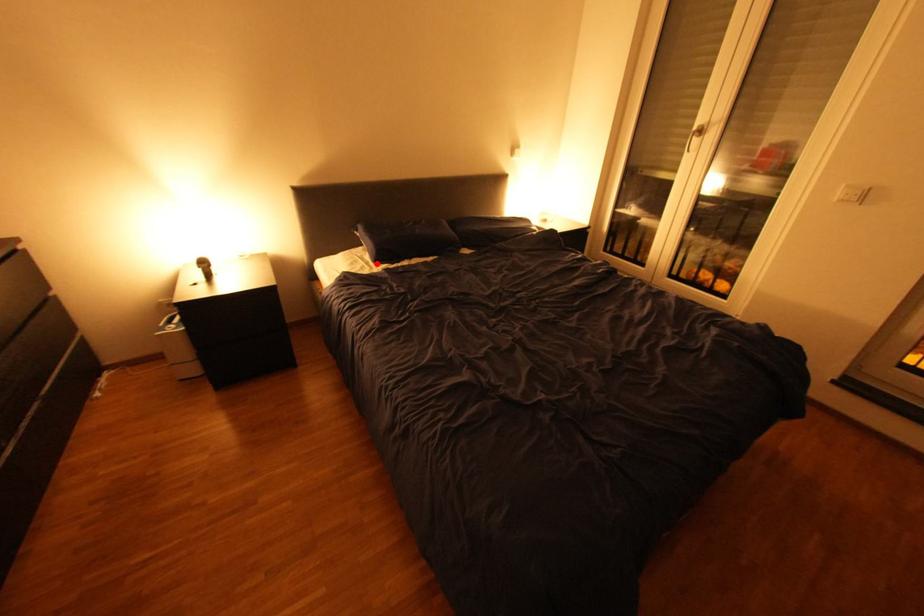
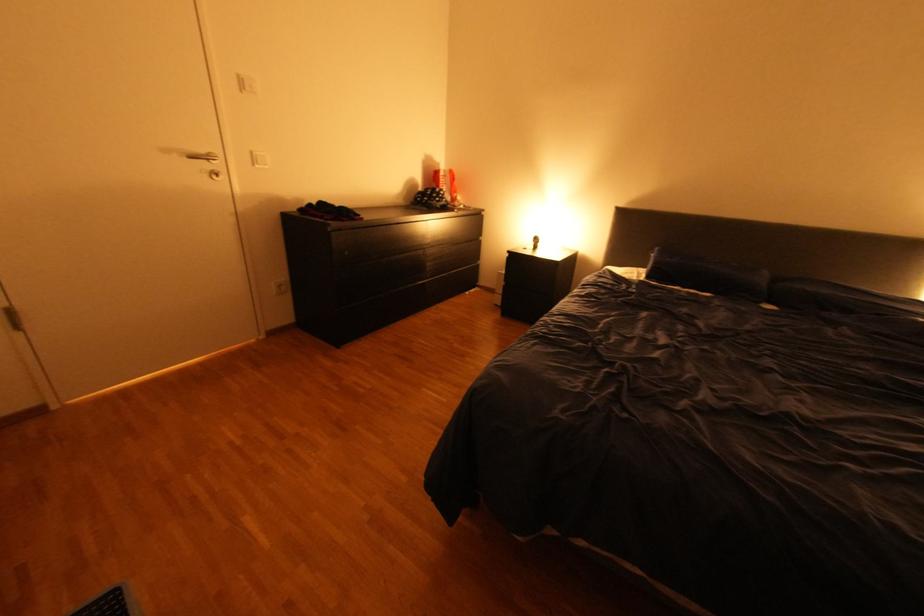
Find the pixel in the second image that matches the highlighted location in the first image.

(648, 277)